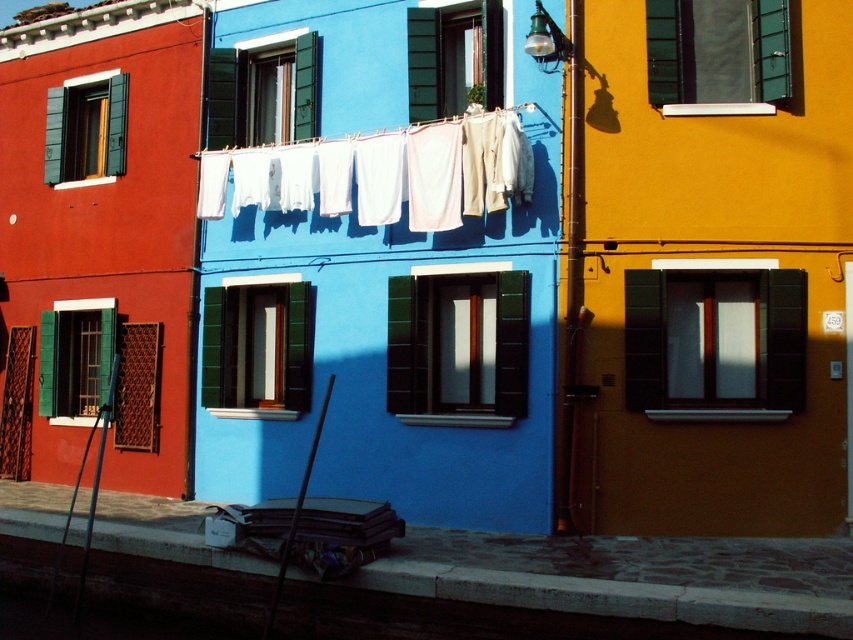
Question: Estimate the real-world distances between objects in this image. Which object is farther from the green matte shutter at upper center?

Choices:
 (A) white cotton pants at center
 (B) green matte shutter at upper left
 (C) green matte shutter at center

Answer: (B)

Question: In this image, where is green matte shutter at upper center located relative to green matte shutter at upper left?

Choices:
 (A) below
 (B) above

Answer: (B)

Question: Is green matte shutter at upper center bigger than green matte shutter at center?

Choices:
 (A) yes
 (B) no

Answer: (A)

Question: Does white cotton pants at center come in front of green matte shutter at center?

Choices:
 (A) no
 (B) yes

Answer: (B)

Question: Which object is the closest to the green matte shutter at center?

Choices:
 (A) white cotton pants at center
 (B) green matte shutter at upper center
 (C) green matte shutter at upper left

Answer: (C)

Question: Which of the following is the farthest from the observer?

Choices:
 (A) (140, 433)
 (B) (468, 193)

Answer: (A)